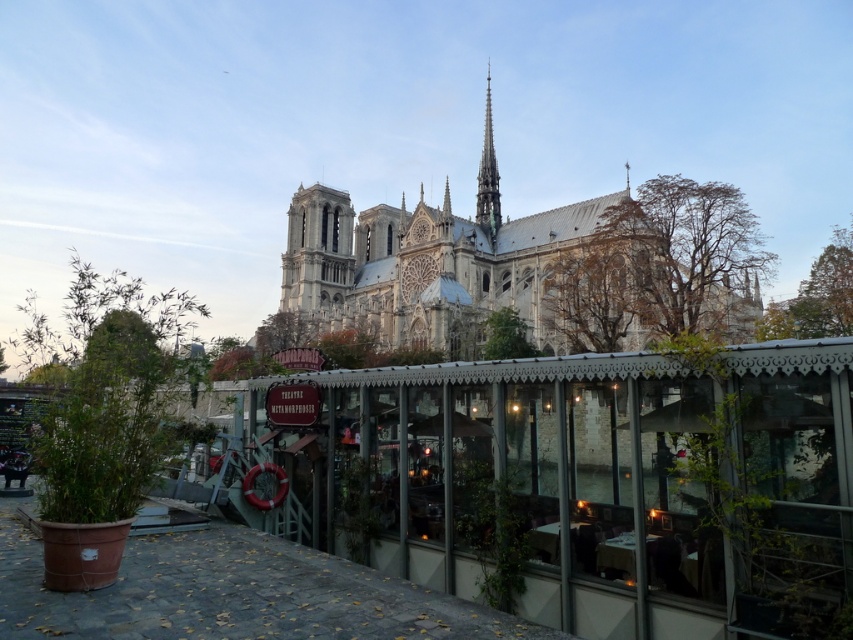
You are an architect analyzing the spatial relationship between the white stone church at center and the green copper spire at upper center. Which object occupies a larger area in the image?

The white stone church at center is bigger than the green copper spire at upper center, so it occupies a larger area in the image.

You are a tour guide standing 20 meters away from the white stone church at center. You want to walk straight towards the green copper spire at upper center. Will you collide with the church before reaching the spire?

The white stone church at center is 28.09 meters away from the green copper spire at upper center. Since you are starting 20 meters away from the church and walking towards the spire, you have 8.09 meters between you and the spire when you reach the church. Therefore, you will not collide with the church before reaching the spire.

You are a tourist standing in front of the Th?tre Metamorphosis. You want to take a photo of the green copper spire at upper center without the white stone church at center blocking the view. Is this possible?

The white stone church at center is in front of the green copper spire at upper center, so it will block the view of the spire. Therefore, it is not possible to take a photo of the green copper spire at upper center without the white stone church at center blocking the view.